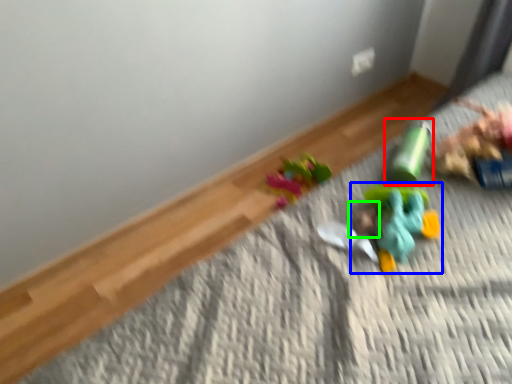
Question: Considering the real-world distances, which object is farthest from toy (highlighted by a red box)? toy (highlighted by a blue box) or head (highlighted by a green box)?

Choices:
 (A) toy
 (B) head

Answer: (B)